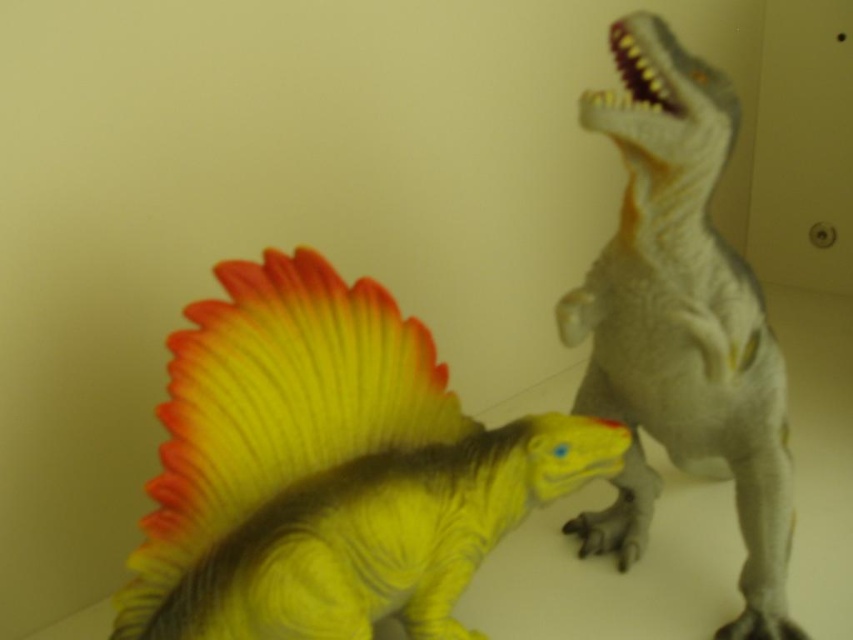
Question: Which point is farther from the camera taking this photo?

Choices:
 (A) (786, 433)
 (B) (172, 564)

Answer: (A)

Question: Is shiny yellow dinosaur at center in front of gray matte plastic dinosaur at upper right?

Choices:
 (A) yes
 (B) no

Answer: (A)

Question: Which of the following is the closest to the observer?

Choices:
 (A) gray matte plastic dinosaur at upper right
 (B) shiny yellow dinosaur at center

Answer: (B)

Question: Is shiny yellow dinosaur at center above gray matte plastic dinosaur at upper right?

Choices:
 (A) no
 (B) yes

Answer: (A)

Question: Is shiny yellow dinosaur at center bigger than gray matte plastic dinosaur at upper right?

Choices:
 (A) yes
 (B) no

Answer: (B)